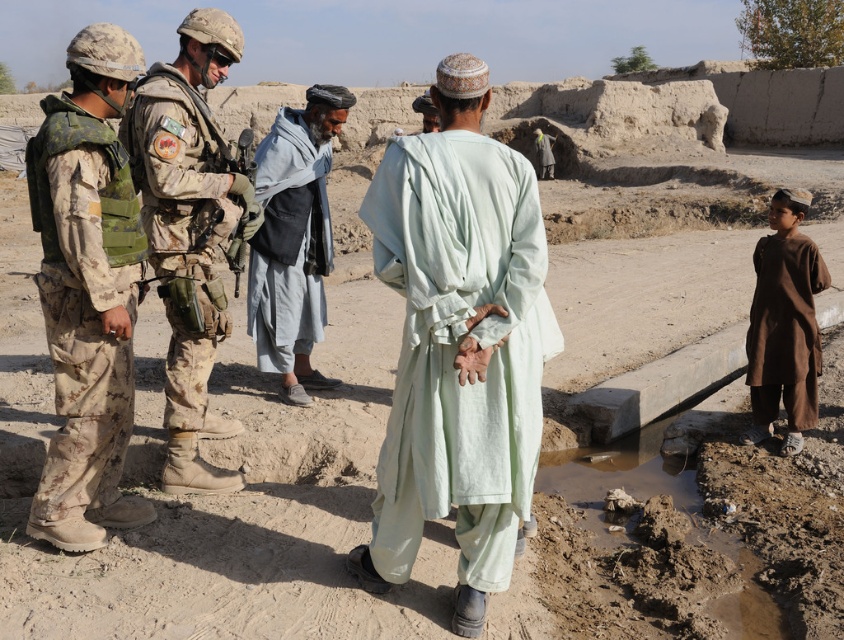
Question: Which point is closer to the camera taking this photo?

Choices:
 (A) (220, 161)
 (B) (111, 296)

Answer: (B)

Question: Which of the following is the closest to the observer?

Choices:
 (A) camouflage fabric robe at left
 (B) light blue fabric at center
 (C) brown cotton dress at lower right

Answer: (A)

Question: Does camouflage fabric robe at left appear under camouflage fabric uniform at center?

Choices:
 (A) no
 (B) yes

Answer: (B)

Question: Considering the real-world distances, which object is farthest from the camouflage fabric uniform at center?

Choices:
 (A) camouflage fabric robe at left
 (B) light green fabric at center

Answer: (B)

Question: Is camouflage fabric robe at left to the right of brown cotton dress at lower right from the viewer's perspective?

Choices:
 (A) no
 (B) yes

Answer: (A)

Question: Does light green fabric at center have a larger size compared to brown cotton dress at lower right?

Choices:
 (A) no
 (B) yes

Answer: (B)